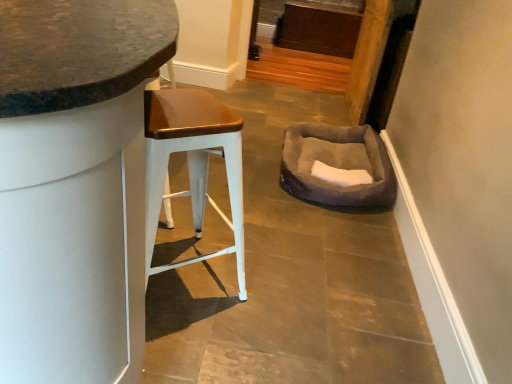
The width and height of the screenshot is (512, 384). What are the coordinates of `empty space that is ontop of white metal stool at left (from a real-world perspective)` in the screenshot? It's located at (180, 104).